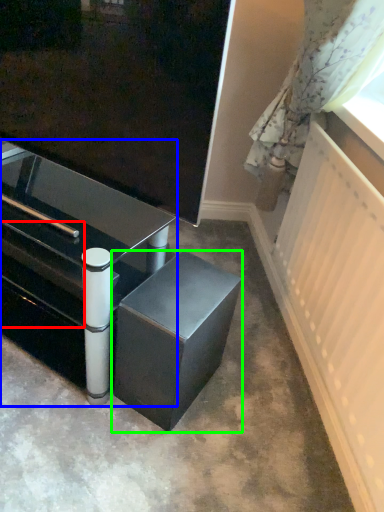
Question: Estimate the real-world distances between objects in this image. Which object is closer to drawer (highlighted by a red box), table (highlighted by a blue box) or furniture (highlighted by a green box)?

Choices:
 (A) table
 (B) furniture

Answer: (A)